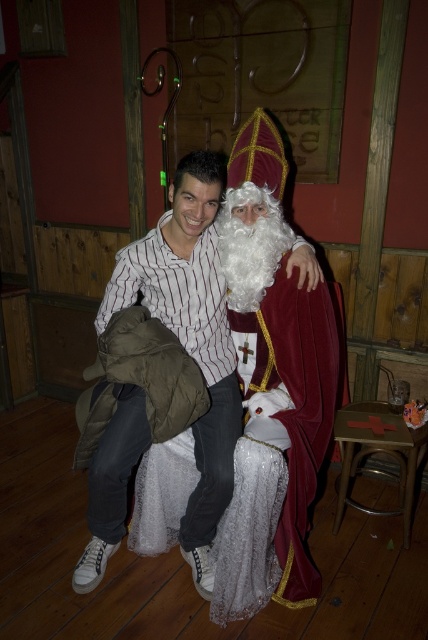
Does white striped shirt at center have a greater height compared to wooden stool at lower right?

Yes, white striped shirt at center is taller than wooden stool at lower right.

Is white striped shirt at center below wooden stool at lower right?

Actually, white striped shirt at center is above wooden stool at lower right.

Find the location of a particular element. white striped shirt at center is located at coordinates (190, 333).

The height and width of the screenshot is (640, 428). What are the coordinates of `white striped shirt at center` in the screenshot? It's located at (190, 333).

Which is more to the right, velvet maroon robe at center or wooden stool at lower right?

From the viewer's perspective, wooden stool at lower right appears more on the right side.

Can you confirm if velvet maroon robe at center is thinner than wooden stool at lower right?

No.

Is point (243, 273) positioned in front of point (376, 432)?

Yes, point (243, 273) is closer to viewer.

This screenshot has width=428, height=640. In order to click on velvet maroon robe at center in this screenshot , I will do `click(270, 387)`.

Who is positioned more to the right, velvet maroon robe at center or white striped shirt at center?

velvet maroon robe at center

Does velvet maroon robe at center have a larger size compared to white striped shirt at center?

Actually, velvet maroon robe at center might be smaller than white striped shirt at center.

You are a GUI agent. You are given a task and a screenshot of the screen. Output one action in this format:
    pyautogui.click(x=<x>, y=<y>)
    Task: Click on the velvet maroon robe at center
    The width and height of the screenshot is (428, 640).
    Given the screenshot: What is the action you would take?
    pyautogui.click(x=270, y=387)

Image resolution: width=428 pixels, height=640 pixels. Find the location of `velvet maroon robe at center`. velvet maroon robe at center is located at coordinates (270, 387).